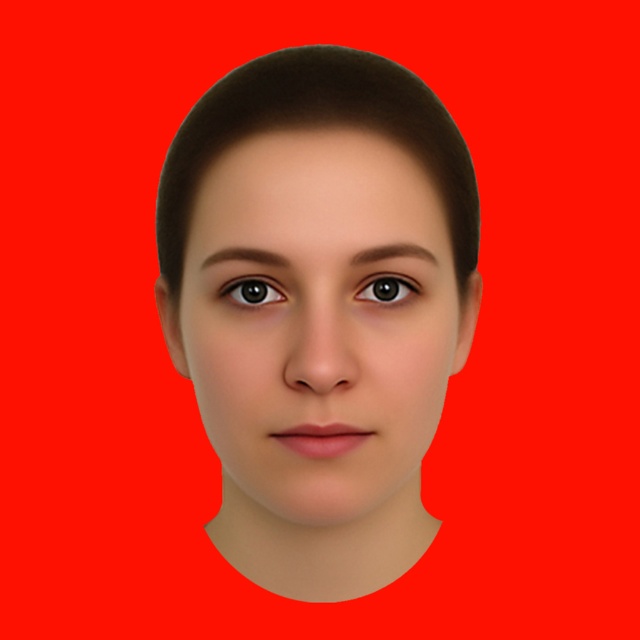
Question: Among these objects, which one is nearest to the camera?

Choices:
 (A) brown glossy eye at upper center
 (B) brown glossy eye at center
 (C) smooth skin face at center

Answer: (C)

Question: Is brown glossy eye at upper center to the right of brown glossy eye at center from the viewer's perspective?

Choices:
 (A) no
 (B) yes

Answer: (A)

Question: From the image, what is the correct spatial relationship of smooth skin face at center in relation to brown glossy eye at upper center?

Choices:
 (A) above
 (B) below

Answer: (B)

Question: Which is farther from the brown glossy eye at upper center?

Choices:
 (A) smooth skin face at center
 (B) brown glossy eye at center

Answer: (A)

Question: Is smooth skin face at center below brown glossy eye at upper center?

Choices:
 (A) yes
 (B) no

Answer: (A)

Question: Which object is positioned closest to the smooth skin face at center?

Choices:
 (A) brown glossy eye at upper center
 (B) brown glossy eye at center

Answer: (A)